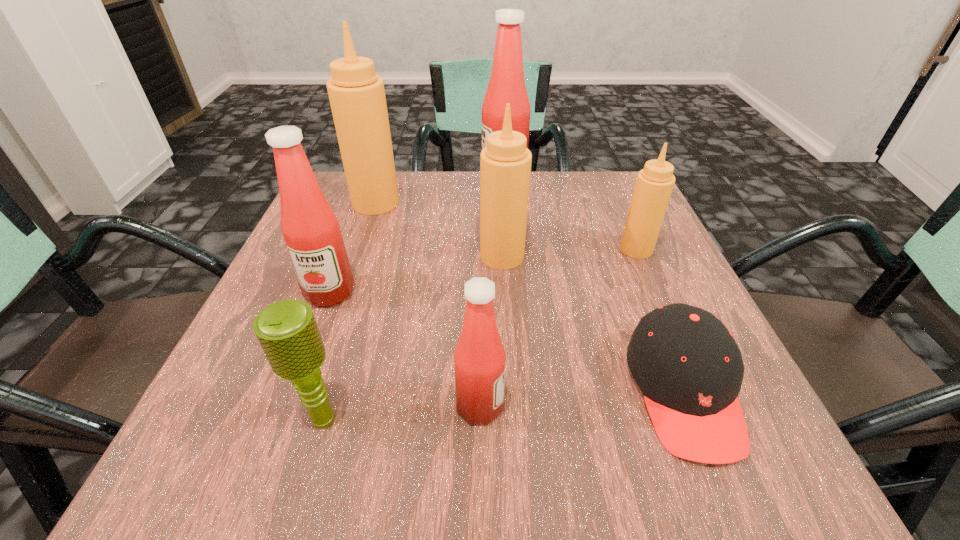
Locate an element on the screen. red condiment that can be found as the third closest to the biggest tan condiment is located at coordinates (479, 359).

Locate an element on the screen. The image size is (960, 540). tan condiment that is the third closest to the biggest red condiment is located at coordinates (654, 184).

Locate which tan condiment is the closest to the microphone. Please provide its 2D coordinates. Your answer should be formatted as a tuple, i.e. [(x, y)], where the tuple contains the x and y coordinates of a point satisfying the conditions above.

[(505, 163)]

Where is `free space that satisfies the following two spatial constraints: 1. on the front-facing side of the fifth farthest condiment; 2. on the right side of the microphone`? This screenshot has width=960, height=540. free space that satisfies the following two spatial constraints: 1. on the front-facing side of the fifth farthest condiment; 2. on the right side of the microphone is located at coordinates (283, 418).

This screenshot has height=540, width=960. In order to click on blank space that satisfies the following two spatial constraints: 1. on the front-facing side of the farthest red condiment; 2. on the front-facing side of the second nearest condiment in this screenshot , I will do `click(512, 292)`.

Image resolution: width=960 pixels, height=540 pixels. I want to click on vacant space that satisfies the following two spatial constraints: 1. on the front-facing side of the biggest red condiment; 2. on the front-facing side of the second nearest condiment, so click(x=512, y=292).

Image resolution: width=960 pixels, height=540 pixels. Identify the location of vacant position in the image that satisfies the following two spatial constraints: 1. on the front side of the second tan condiment from right to left; 2. on the front-facing side of the nearest red condiment. (511, 406).